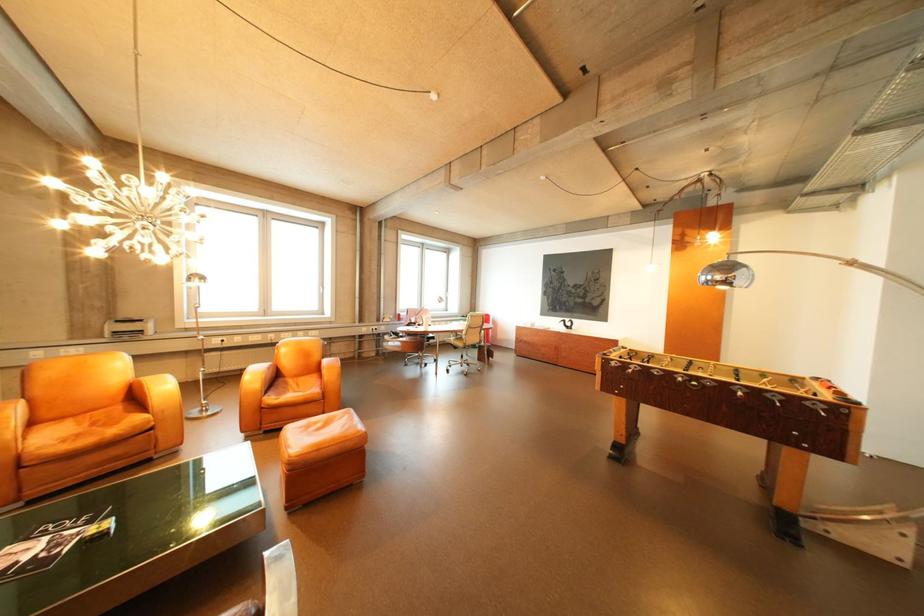
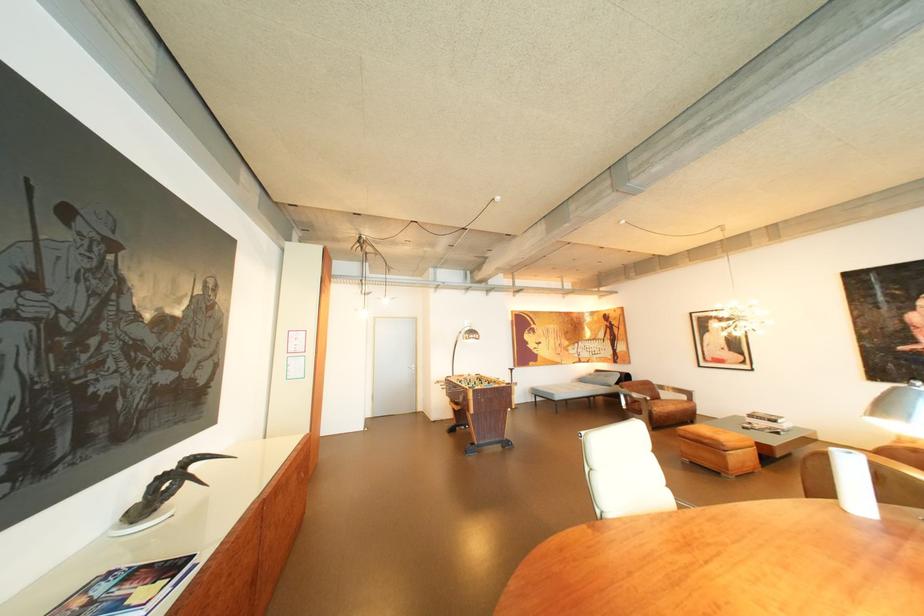
Question: I am providing you with two images of the same scene from different viewpoints. Please identify which objects are invisible in image2.

Choices:
 (A) foosball table handle
 (B) yellow dish soap
 (C) brown chair armrest
 (D) paper roll

Answer: (A)